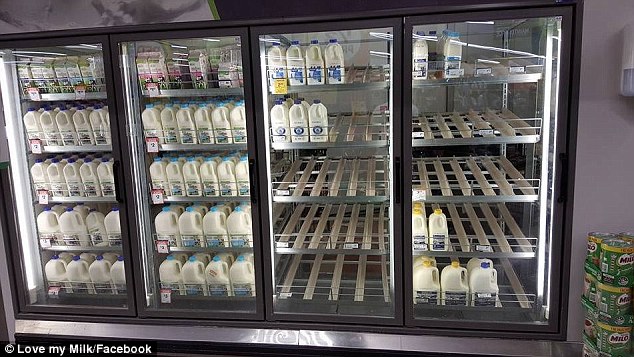
Image resolution: width=634 pixels, height=357 pixels. Identify the location of empty shelf. (331, 183), (331, 230), (337, 283), (470, 179), (462, 123).